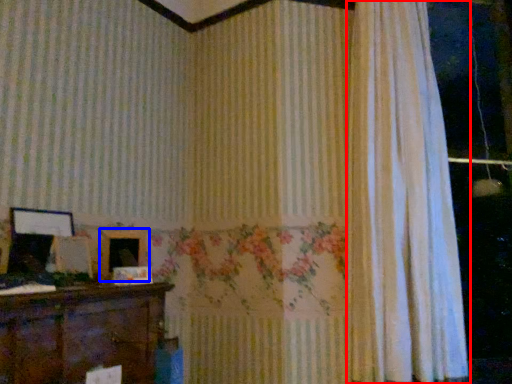
Question: Which object appears farthest to the camera in this image, curtain (highlighted by a red box) or picture frame (highlighted by a blue box)?

Choices:
 (A) curtain
 (B) picture frame

Answer: (A)